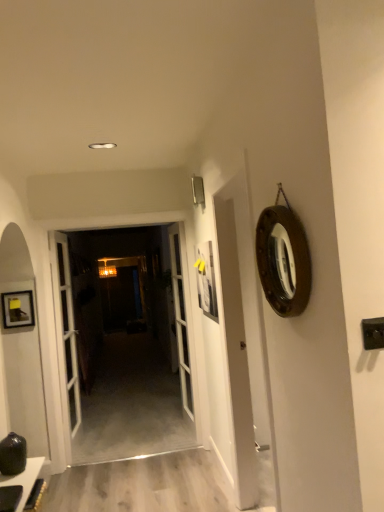
Question: Based on their sizes in the image, would you say white glass door at center, the 2th door in the left-to-right sequence, is bigger or smaller than white glass door at center, which is counted as the 1th door, starting from the left?

Choices:
 (A) small
 (B) big

Answer: (B)

Question: Does point (147, 296) appear closer or farther from the camera than point (64, 407)?

Choices:
 (A) closer
 (B) farther

Answer: (B)

Question: Which is farther from the smooth gray carpet at center?

Choices:
 (A) wooden-framed mirror at upper right
 (B) white glass door at center, the 3th door when ordered from right to left
 (C) white glass door at center, the 2th door in the left-to-right sequence
 (D) matte black table at lower left
 (E) white glass door at center, acting as the 1th door starting from the right

Answer: (A)

Question: Which object is the closest to the matte black table at lower left?

Choices:
 (A) wooden-framed mirror at upper right
 (B) white glass door at center, the 3th door when ordered from right to left
 (C) white glass door at center, the 2th door in the left-to-right sequence
 (D) smooth gray carpet at center
 (E) white glass door at center, marked as the third door in a left-to-right arrangement

Answer: (D)